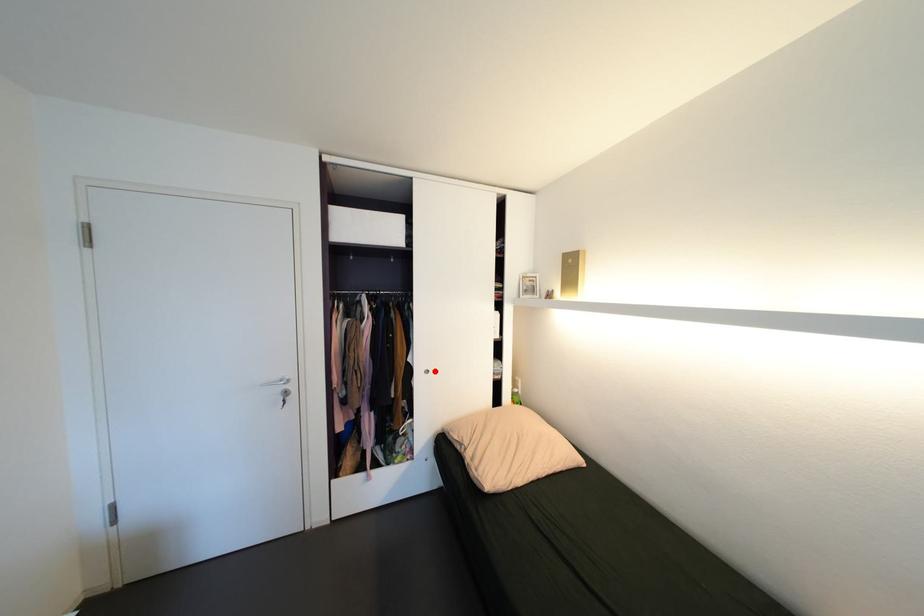
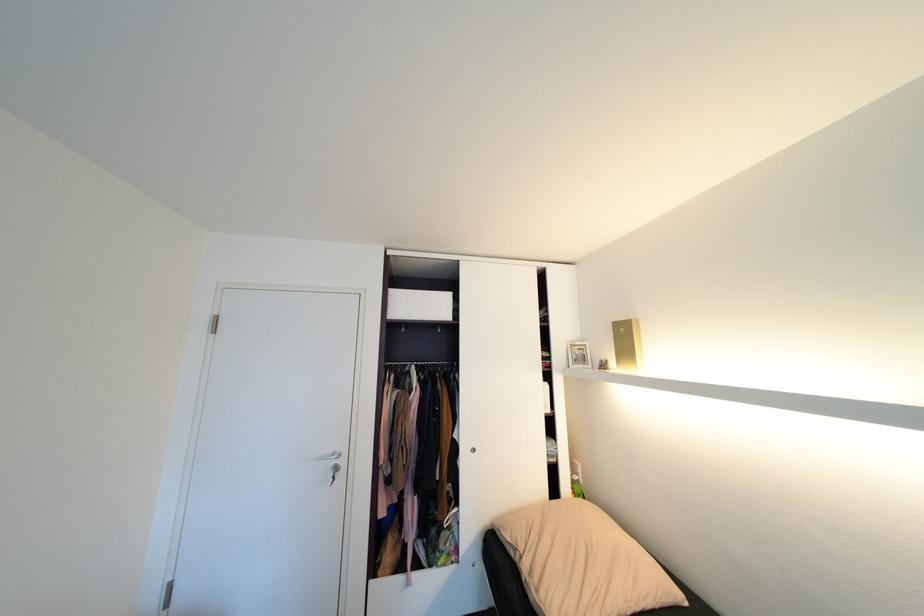
Question: I am providing you with two images of the same scene from different viewpoints. In image1, a red point is highlighted. Considering the same 3D point in image2, which of the following is correct?

Choices:
 (A) It is closer
 (B) It is farther

Answer: (B)